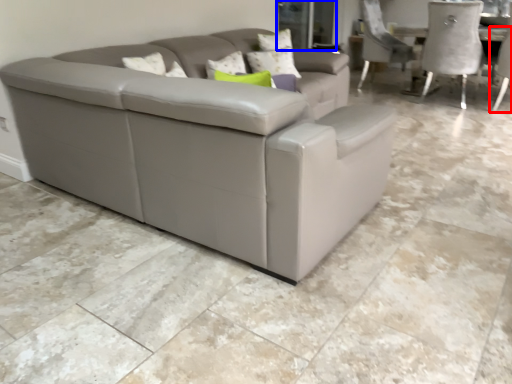
Question: Among these objects, which one is nearest to the camera, chair (highlighted by a red box) or glass door (highlighted by a blue box)?

Choices:
 (A) chair
 (B) glass door

Answer: (A)